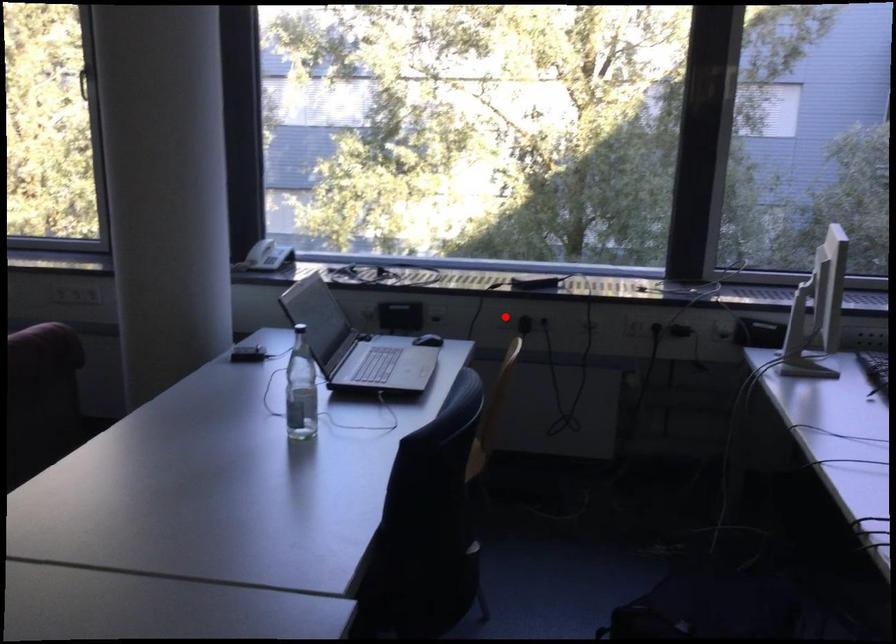
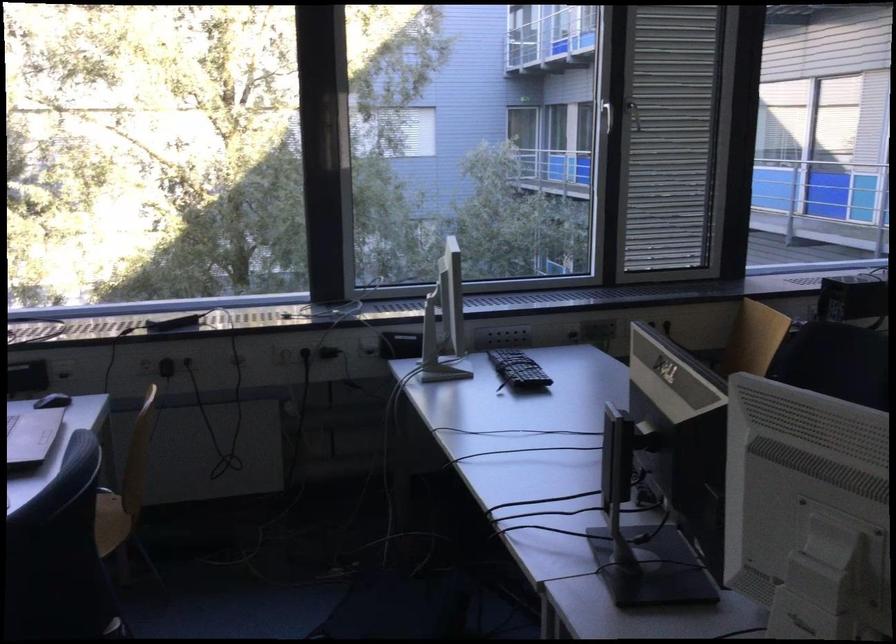
The point at the highlighted location is marked in the first image. Where is the corresponding point in the second image?

(144, 365)